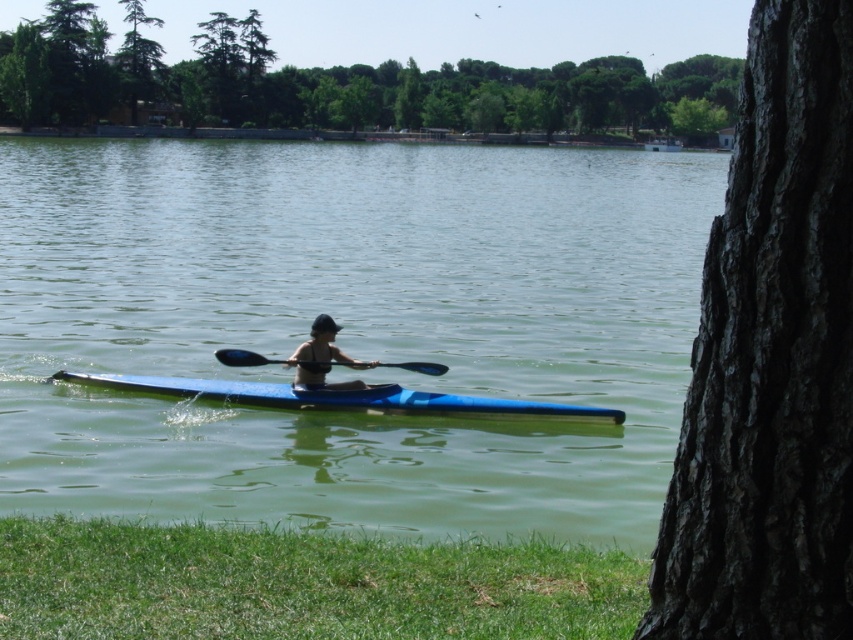
You are standing at the lakeside and want to determine which of the two points, point (323, 346) or point (247, 358), is nearer to you. Based on the scene, which point is closer?

Point (323, 346) is closer to the viewer than point (247, 358).